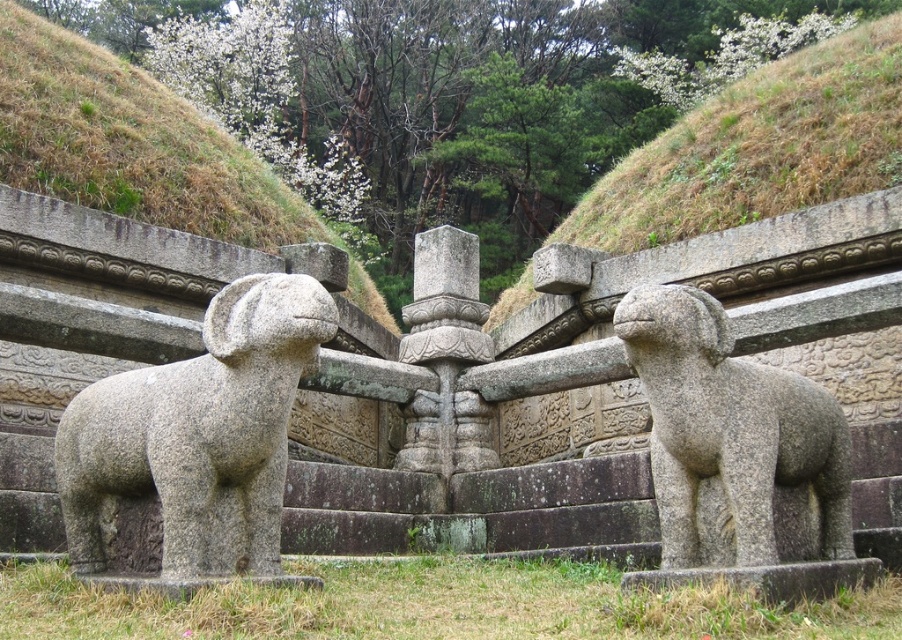
You are standing in front of the central stone structure and want to take a photo of the gray stone dog at left. If your camera can focus on objects up to 30 meters away, will you need to move closer to get a clear shot?

The gray stone dog at left is 31.96 meters from the camera, which is beyond the 30 meters focus range. You need to move closer to ensure the camera can focus properly.

You are a visitor standing in front of the central stone structure. You see the gray stone dog at left and the green grassy hillside at upper center. Which object is located to the left of the other?

The gray stone dog at left is positioned on the left side of green grassy hillside at upper center.

You are standing in front of the central stone structure and want to walk towards the gray stone dog at right. Which direction should you move relative to the green grassy hillside at upper center?

You should move to the left relative to the green grassy hillside at upper center because the gray stone dog at right is positioned to the left of the hillside.